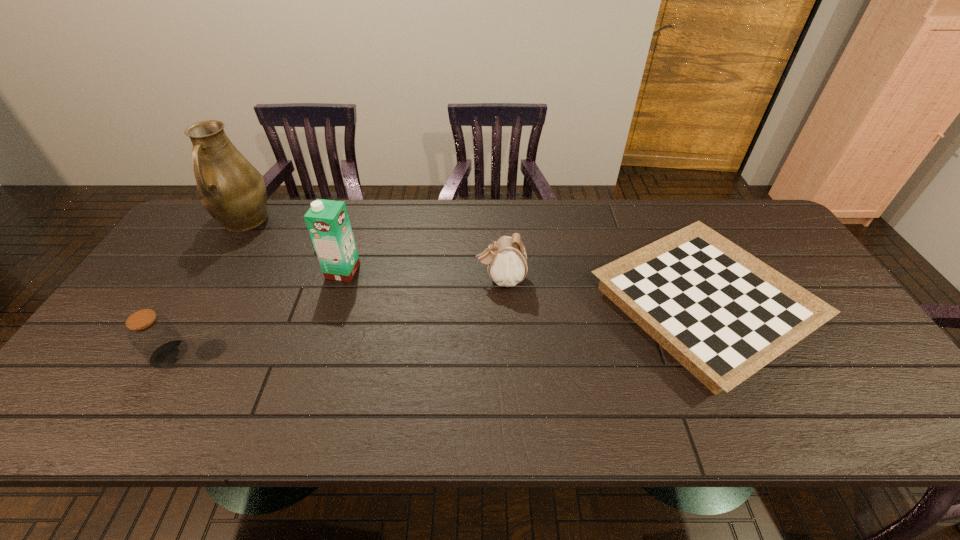
This screenshot has width=960, height=540. Find the location of `pitcher`. pitcher is located at coordinates (229, 187).

Locate an element on the screen. the third object from left to right is located at coordinates (x=328, y=223).

Find the location of a particular element. This screenshot has width=960, height=540. carton is located at coordinates click(x=328, y=223).

Locate an element on the screen. This screenshot has height=540, width=960. pouch is located at coordinates (507, 261).

At what (x,y) coordinates should I click in order to perform the action: click on the fourth tallest object. Please return your answer as a coordinate pair (x, y). Looking at the image, I should click on (154, 336).

Find the location of a particular element. The image size is (960, 540). checkerboard is located at coordinates (722, 313).

Image resolution: width=960 pixels, height=540 pixels. What are the coordinates of `the shortest object` in the screenshot? It's located at (722, 313).

You are a GUI agent. You are given a task and a screenshot of the screen. Output one action in this format:
    pyautogui.click(x=<x>, y=<y>)
    Task: Click on the vacant area located on the handle side of the pitcher
    Image resolution: width=960 pixels, height=540 pixels.
    Given the screenshot: What is the action you would take?
    pyautogui.click(x=175, y=333)

Image resolution: width=960 pixels, height=540 pixels. I want to click on vacant area located 0.310m on the right of the carton, so click(x=467, y=271).

At what (x,y) coordinates should I click in order to perform the action: click on vacant area situated 0.110m on the front-facing side of the fourth object from left to right. Please return your answer as a coordinate pair (x, y). Looking at the image, I should click on (437, 279).